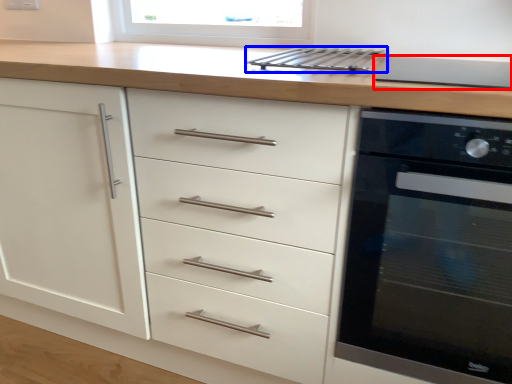
Question: Which object is further to the camera taking this photo, appliance (highlighted by a red box) or kitchen appliance (highlighted by a blue box)?

Choices:
 (A) appliance
 (B) kitchen appliance

Answer: (B)